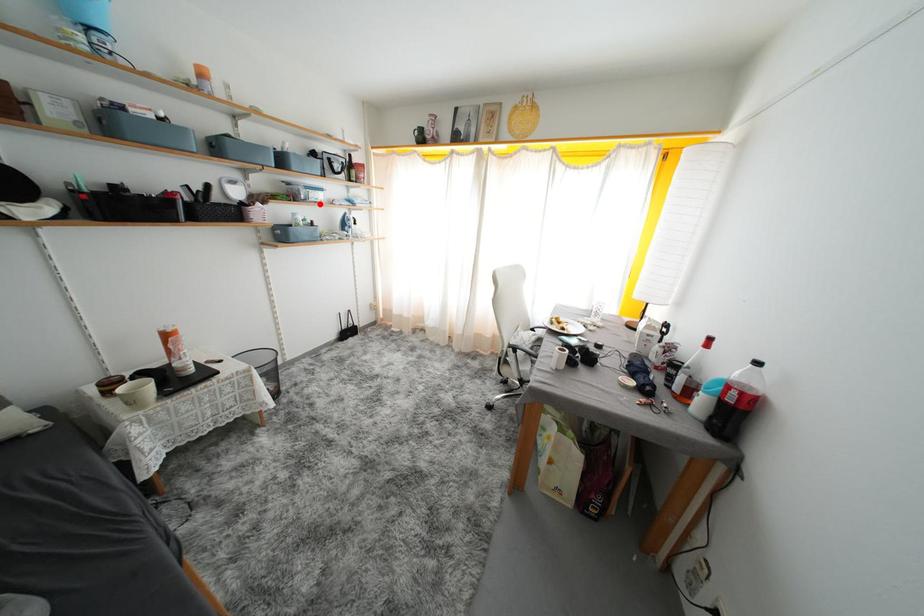
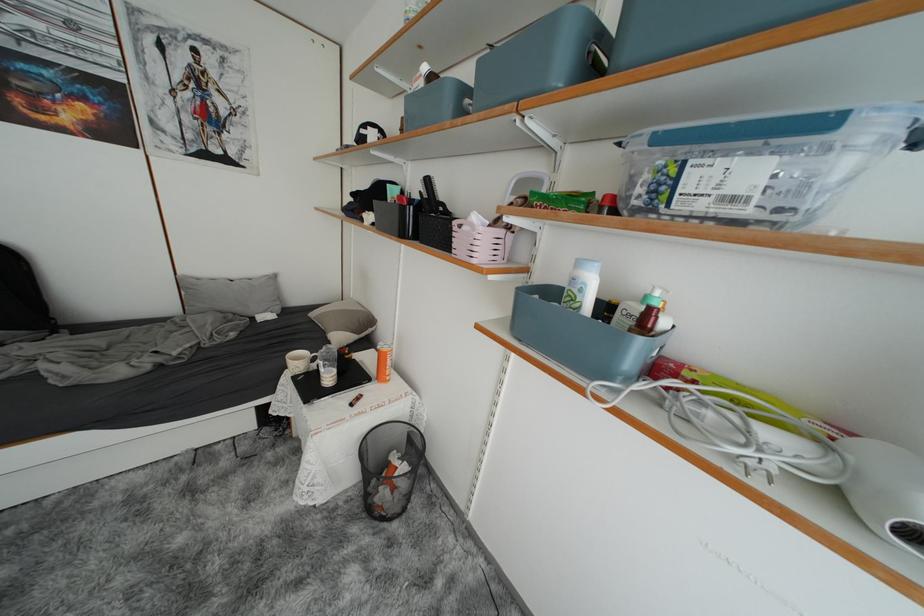
Question: A red point is marked in image1. In image2, is the corresponding 3D point closer to the camera or farther? Reply with the corresponding letter.

Choices:
 (A) The corresponding 3D point is closer.
 (B) The corresponding 3D point is farther.

Answer: (B)